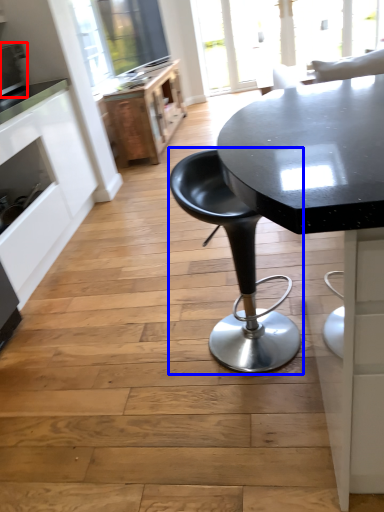
Question: Which object appears farthest to the camera in this image, appliance (highlighted by a red box) or chair (highlighted by a blue box)?

Choices:
 (A) appliance
 (B) chair

Answer: (A)